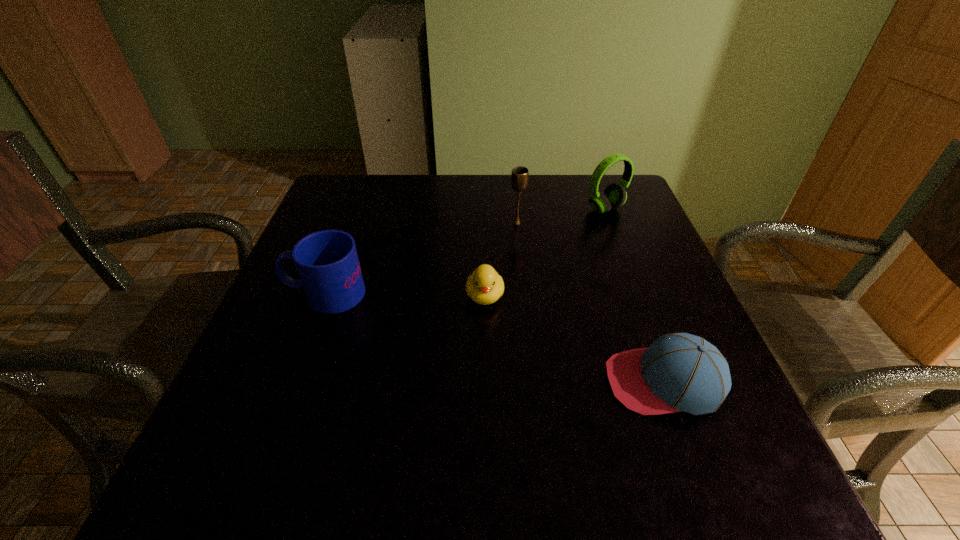
Locate an element on the screen. vacant point located between the farthest object and the duckling is located at coordinates (545, 252).

The height and width of the screenshot is (540, 960). What are the coordinates of `free area in between the duckling and the chalice` in the screenshot? It's located at (501, 259).

Find the location of a particular element. The image size is (960, 540). free space between the duckling and the second farthest object is located at coordinates (501, 259).

This screenshot has height=540, width=960. I want to click on free space between the nearest object and the fourth nearest object, so click(x=590, y=302).

Where is `vacant space that is in between the farthest object and the baseball cap`? The width and height of the screenshot is (960, 540). vacant space that is in between the farthest object and the baseball cap is located at coordinates (635, 295).

Where is `vacant space in between the nearest object and the farthest object`? The height and width of the screenshot is (540, 960). vacant space in between the nearest object and the farthest object is located at coordinates (635, 295).

Locate which object ranks second in proximity to the duckling. Please provide its 2D coordinates. Your answer should be formatted as a tuple, i.e. [(x, y)], where the tuple contains the x and y coordinates of a point satisfying the conditions above.

[(678, 372)]

The image size is (960, 540). What are the coordinates of `object that stands as the second closest to the headset` in the screenshot? It's located at (484, 286).